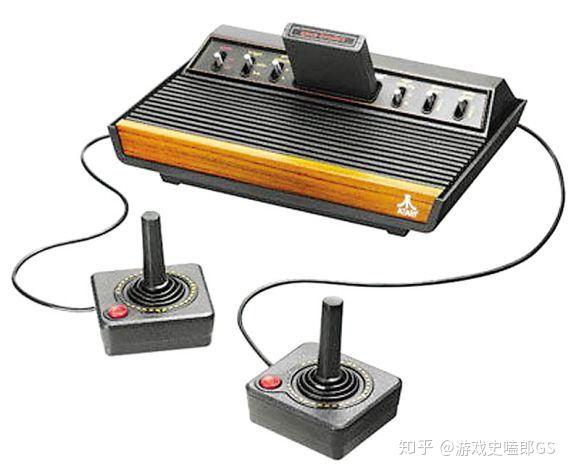
Where is `wood panel on console`? The image size is (570, 473). wood panel on console is located at coordinates (290, 173).